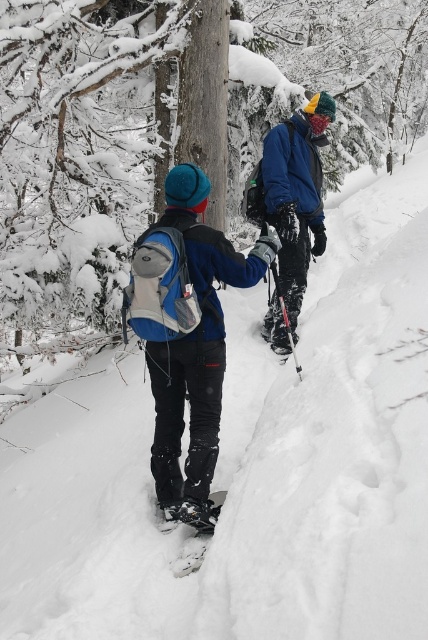
You are a hiker who wants to locate the matte blue jacket at center in the snowy forest. According to the coordinates provided, where exactly should you look?

The matte blue jacket at center is located at coordinates point (x=228, y=284).

You are planning to take a photo of the blue matte jacket at center and the black matte ski at lower center. Since you want the jacket to look bigger in the photo than the ski, which object should you focus on and get closer to?

The blue matte jacket at center is wider than the black matte ski at lower center. To make the jacket appear larger in the photo, you should focus on and get closer to the blue matte jacket at center.

You are a hiker planning to take a shortcut through the snowy forest. You see the matte blue jacket at center and the black matte ski at lower center. Which object would you encounter first while moving forward?

The matte blue jacket at center is in front of the black matte ski at lower center, so you would encounter the matte blue jacket at center first.